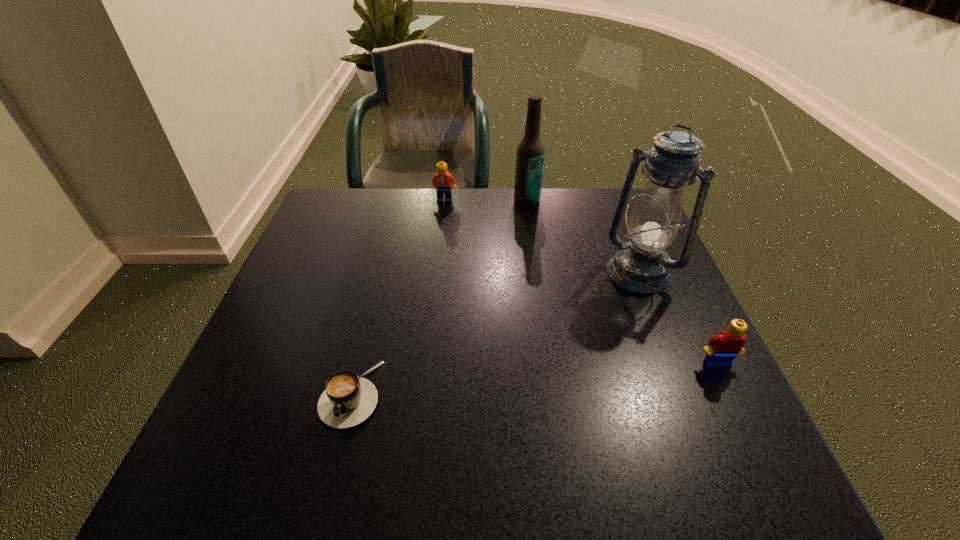
Find the location of a particular element. This screenshot has width=960, height=540. free spot on the desktop that is between the shortest object and the right Lego and is positioned on the front-facing side of the farther Lego is located at coordinates (526, 380).

Where is `free spot on the desktop that is between the cappuccino and the nearer Lego and is positioned on the label of the beer bottle`? free spot on the desktop that is between the cappuccino and the nearer Lego and is positioned on the label of the beer bottle is located at coordinates (509, 381).

Locate an element on the screen. Image resolution: width=960 pixels, height=540 pixels. free space on the desktop that is between the cappuccino and the nearer Lego and is positioned on the front-facing side of the third farthest object is located at coordinates (557, 377).